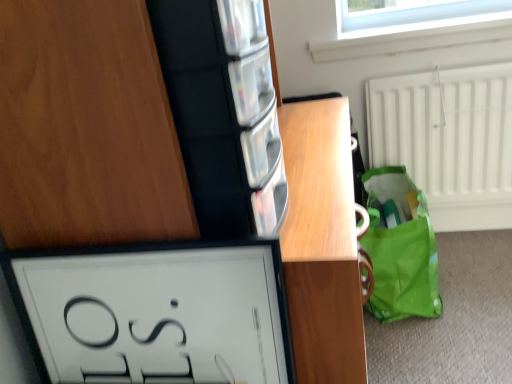
Question: Is clear glass window at upper center outside of wooden vanity at center?

Choices:
 (A) no
 (B) yes

Answer: (B)

Question: Considering the relative sizes of clear glass window at upper center and wooden vanity at center in the image provided, is clear glass window at upper center taller than wooden vanity at center?

Choices:
 (A) no
 (B) yes

Answer: (A)

Question: Is clear glass window at upper center positioned with its back to wooden vanity at center?

Choices:
 (A) no
 (B) yes

Answer: (A)

Question: From the image's perspective, does clear glass window at upper center appear higher than wooden vanity at center?

Choices:
 (A) no
 (B) yes

Answer: (B)

Question: Can you confirm if clear glass window at upper center is bigger than wooden vanity at center?

Choices:
 (A) no
 (B) yes

Answer: (A)

Question: Is the depth of clear glass window at upper center less than that of wooden vanity at center?

Choices:
 (A) no
 (B) yes

Answer: (A)

Question: Is the position of wooden vanity at center more distant than that of white glossy picture frame at lower left?

Choices:
 (A) no
 (B) yes

Answer: (A)

Question: Considering the relative sizes of wooden vanity at center and white glossy picture frame at lower left in the image provided, is wooden vanity at center wider than white glossy picture frame at lower left?

Choices:
 (A) no
 (B) yes

Answer: (B)

Question: From a real-world perspective, is wooden vanity at center positioned over white glossy picture frame at lower left based on gravity?

Choices:
 (A) yes
 (B) no

Answer: (B)

Question: From the image's perspective, is wooden vanity at center located beneath white glossy picture frame at lower left?

Choices:
 (A) no
 (B) yes

Answer: (A)

Question: Does wooden vanity at center turn towards white glossy picture frame at lower left?

Choices:
 (A) yes
 (B) no

Answer: (B)

Question: Can you confirm if wooden vanity at center is positioned to the left of white glossy picture frame at lower left?

Choices:
 (A) no
 (B) yes

Answer: (A)

Question: Is green fabric tote at lower right aimed at matte wood cabinet at upper left?

Choices:
 (A) yes
 (B) no

Answer: (B)